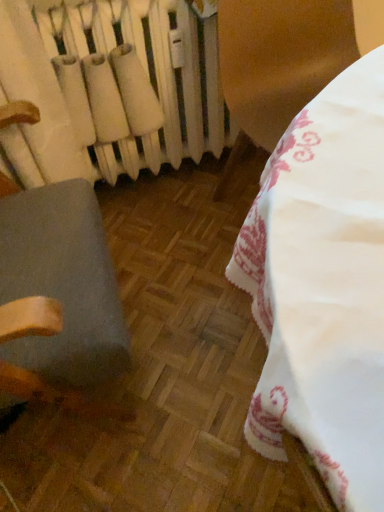
Question: Is gray fabric chair at left at the left side of white matte radiator at upper left?

Choices:
 (A) yes
 (B) no

Answer: (A)

Question: Is gray fabric chair at left taller than white matte radiator at upper left?

Choices:
 (A) yes
 (B) no

Answer: (A)

Question: From a real-world perspective, is gray fabric chair at left located higher than white matte radiator at upper left?

Choices:
 (A) yes
 (B) no

Answer: (A)

Question: From a real-world perspective, is gray fabric chair at left beneath white matte radiator at upper left?

Choices:
 (A) yes
 (B) no

Answer: (B)

Question: Is gray fabric chair at left further to camera compared to white matte radiator at upper left?

Choices:
 (A) no
 (B) yes

Answer: (A)

Question: Is gray fabric chair at left looking in the opposite direction of white matte radiator at upper left?

Choices:
 (A) yes
 (B) no

Answer: (B)

Question: Is white matte radiator at upper left at the right side of gray fabric chair at left?

Choices:
 (A) yes
 (B) no

Answer: (A)

Question: Is white matte radiator at upper left in front of gray fabric chair at left?

Choices:
 (A) yes
 (B) no

Answer: (B)

Question: Does white matte radiator at upper left have a greater width compared to gray fabric chair at left?

Choices:
 (A) no
 (B) yes

Answer: (A)

Question: Is white matte radiator at upper left positioned with its back to gray fabric chair at left?

Choices:
 (A) no
 (B) yes

Answer: (A)

Question: Does white matte radiator at upper left contain gray fabric chair at left?

Choices:
 (A) yes
 (B) no

Answer: (B)

Question: Considering the relative sizes of white matte radiator at upper left and gray fabric chair at left in the image provided, is white matte radiator at upper left bigger than gray fabric chair at left?

Choices:
 (A) no
 (B) yes

Answer: (A)

Question: Do you think gray fabric chair at left is within white matte radiator at upper left, or outside of it?

Choices:
 (A) inside
 (B) outside

Answer: (B)